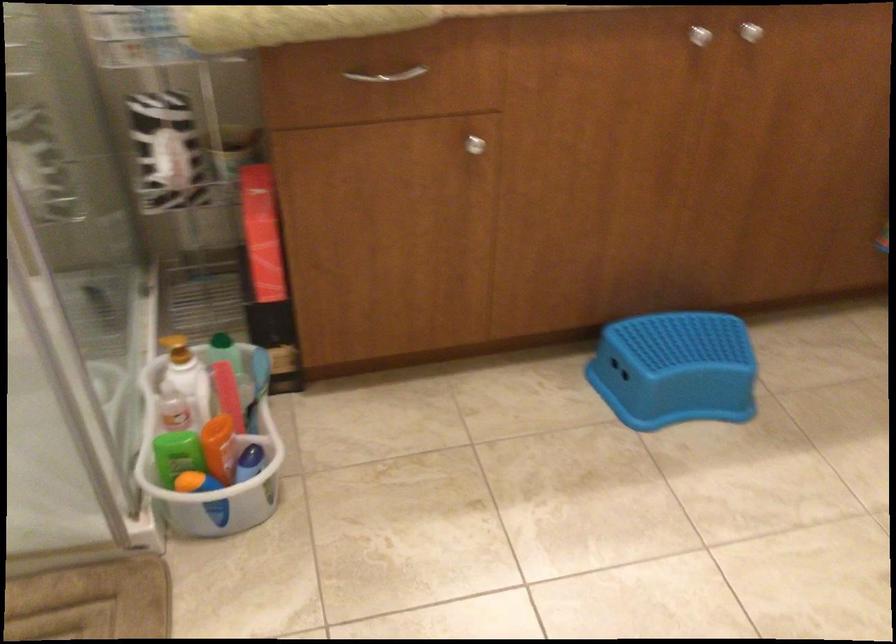
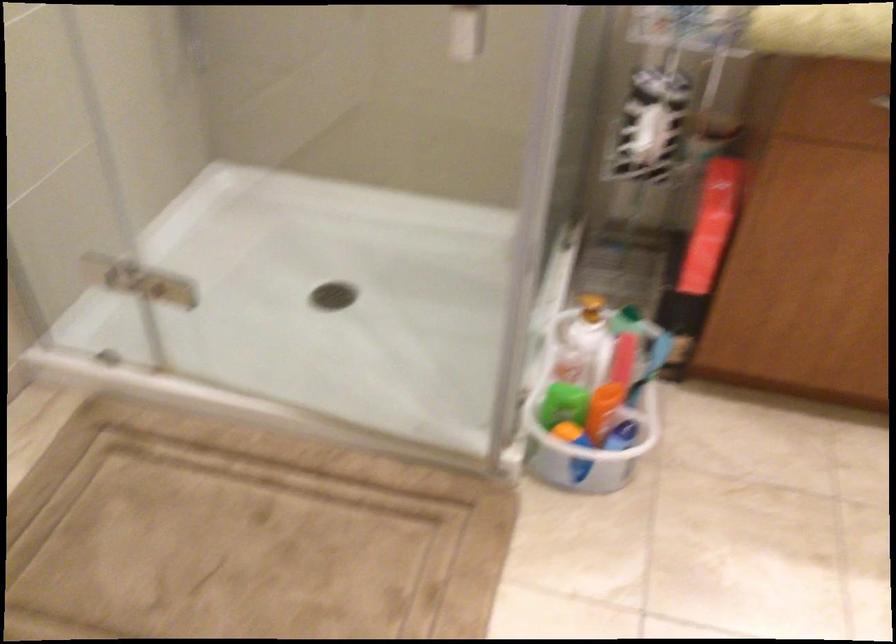
Question: The camera is either moving clockwise (left) or counter-clockwise (right) around the object. The first image is from the beginning of the video and the second image is from the end. Is the camera moving left or right when shooting the video?

Choices:
 (A) Left
 (B) Right

Answer: (B)